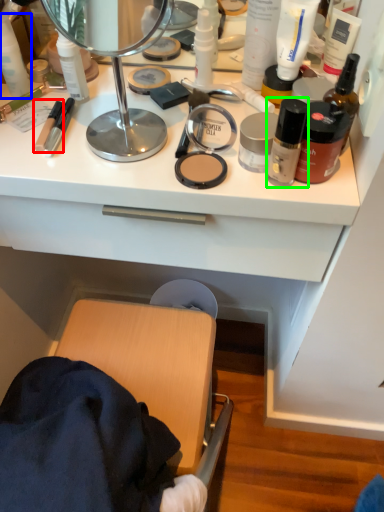
Question: Based on their relative distances, which object is farther from toiletry (highlighted by a red box)? Choose from toiletry (highlighted by a blue box) and toiletry (highlighted by a green box).

Choices:
 (A) toiletry
 (B) toiletry

Answer: (B)